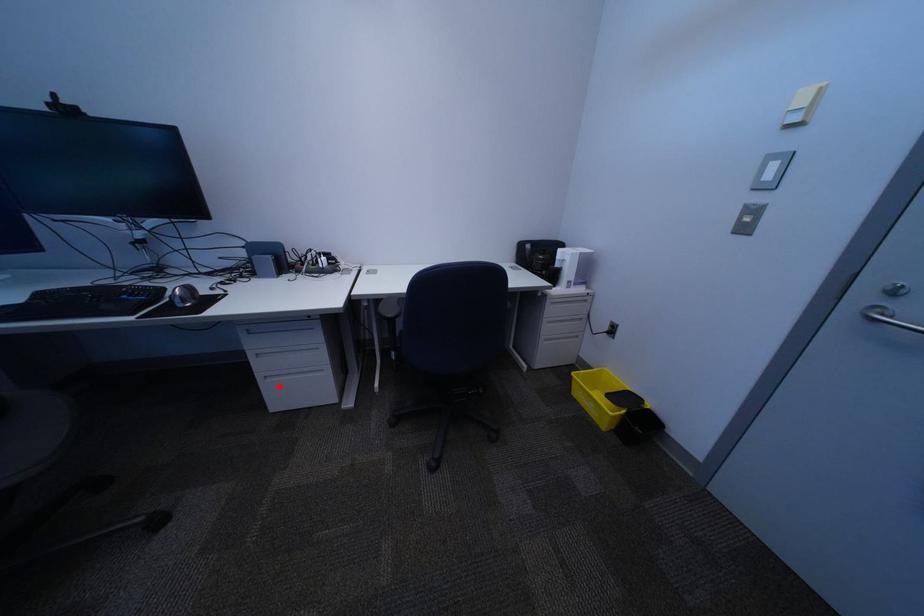
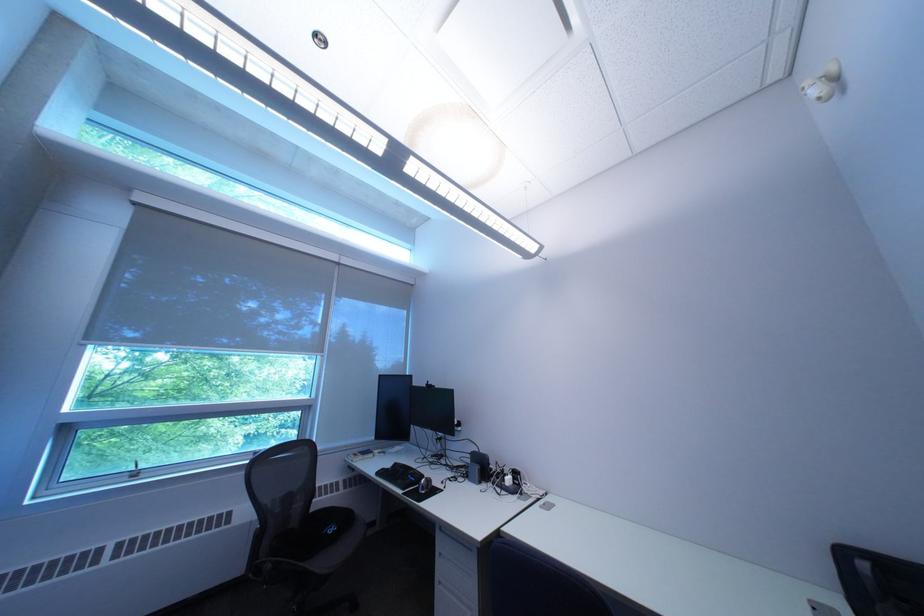
Where in the second image is the point corresponding to the highlighted location from the first image?

(454, 592)